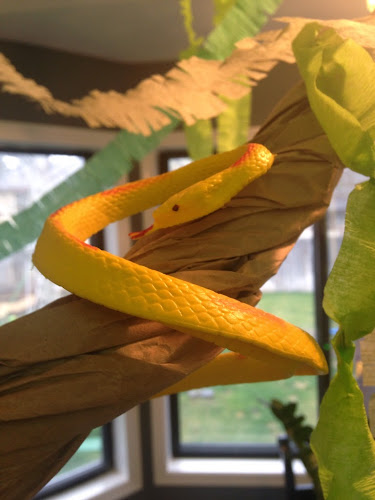
The image size is (375, 500). What are the coordinates of `window` in the screenshot? It's located at (294, 271), (36, 269).